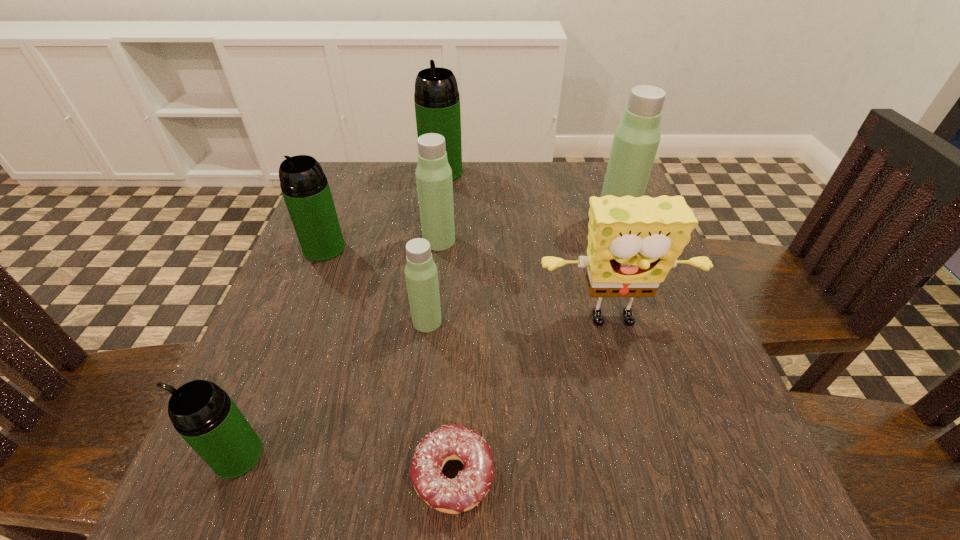
Identify the location of the rightmost green thermos bottle. pyautogui.click(x=437, y=102).

Identify the location of the farthest object. This screenshot has width=960, height=540. point(437,102).

Where is `the rightmost thermos bottle`? This screenshot has height=540, width=960. the rightmost thermos bottle is located at coordinates (637, 137).

What are the coordinates of `the rightmost light thermos bottle` in the screenshot? It's located at (637, 137).

The width and height of the screenshot is (960, 540). I want to click on the second farthest green thermos bottle, so click(304, 186).

Where is `the second smallest light thermos bottle`? the second smallest light thermos bottle is located at coordinates (433, 173).

The height and width of the screenshot is (540, 960). I want to click on sponge, so click(x=633, y=242).

Identify the location of the nearest light thermos bottle. (421, 274).

I want to click on the smallest light thermos bottle, so click(x=421, y=274).

I want to click on the nearest green thermos bottle, so click(x=205, y=416).